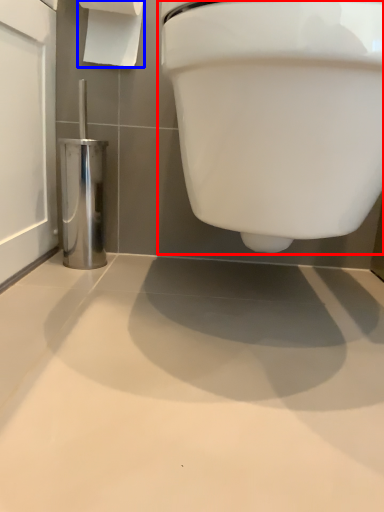
Question: Which point is further to the camera, toilet (highlighted by a red box) or toilet paper (highlighted by a blue box)?

Choices:
 (A) toilet
 (B) toilet paper

Answer: (B)